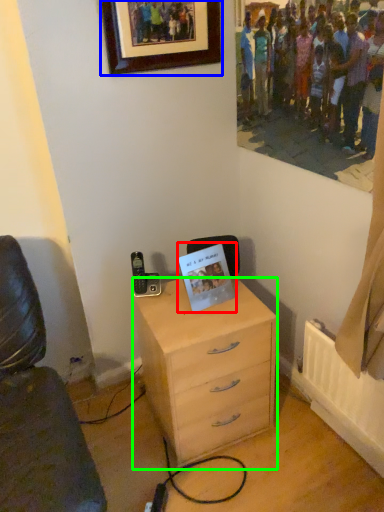
Question: Based on their relative distances, which object is nearer to postcard (highlighted by a red box)? Choose from picture frame (highlighted by a blue box) and chest of drawers (highlighted by a green box).

Choices:
 (A) picture frame
 (B) chest of drawers

Answer: (B)